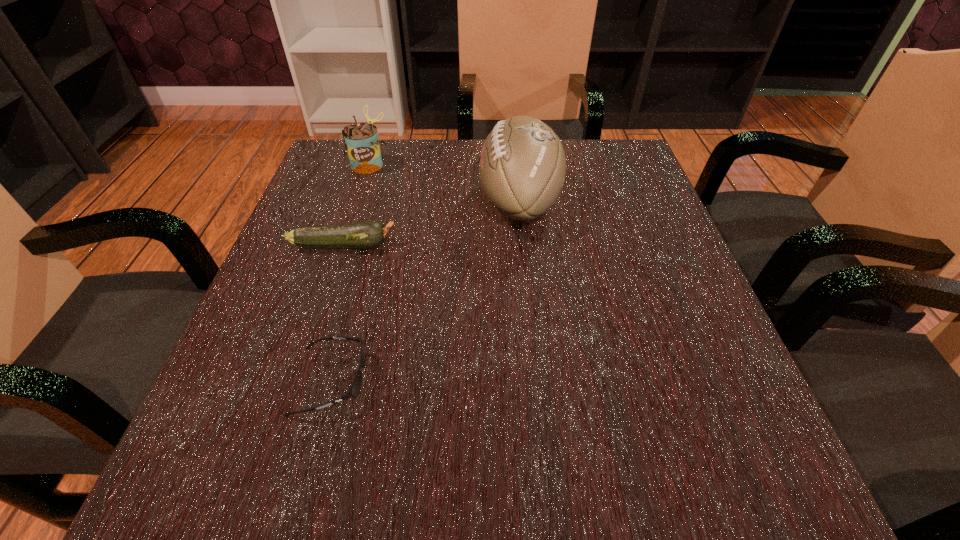
I want to click on vacant point located between the second shortest object and the shortest object, so click(x=337, y=313).

Find the location of a particular element. The height and width of the screenshot is (540, 960). free space between the tallest object and the third shortest object is located at coordinates (444, 183).

Identify which object is located as the nearest to the can. Please provide its 2D coordinates. Your answer should be formatted as a tuple, i.e. [(x, y)], where the tuple contains the x and y coordinates of a point satisfying the conditions above.

[(522, 165)]

Point out which object is positioned as the third nearest to the nearest object. Please provide its 2D coordinates. Your answer should be formatted as a tuple, i.e. [(x, y)], where the tuple contains the x and y coordinates of a point satisfying the conditions above.

[(361, 141)]